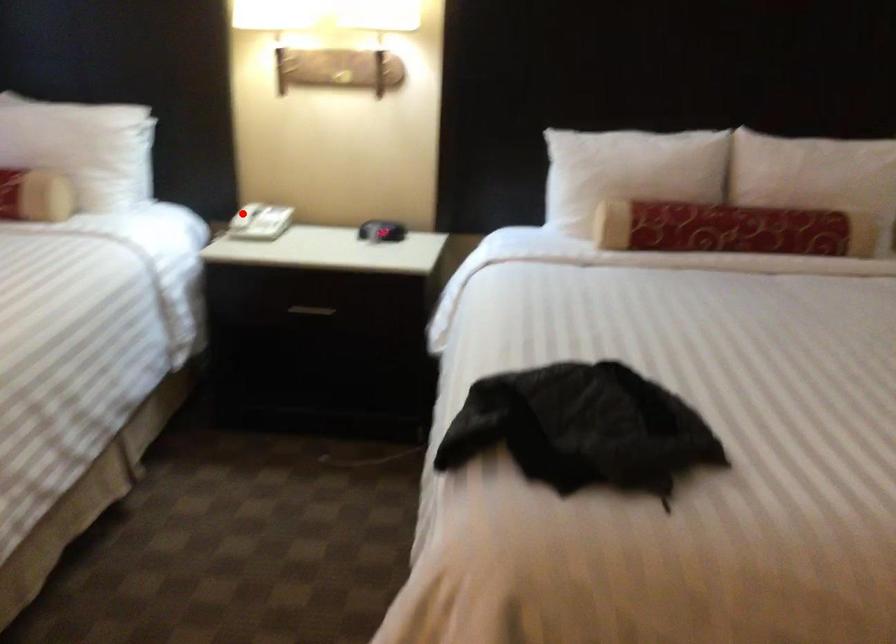
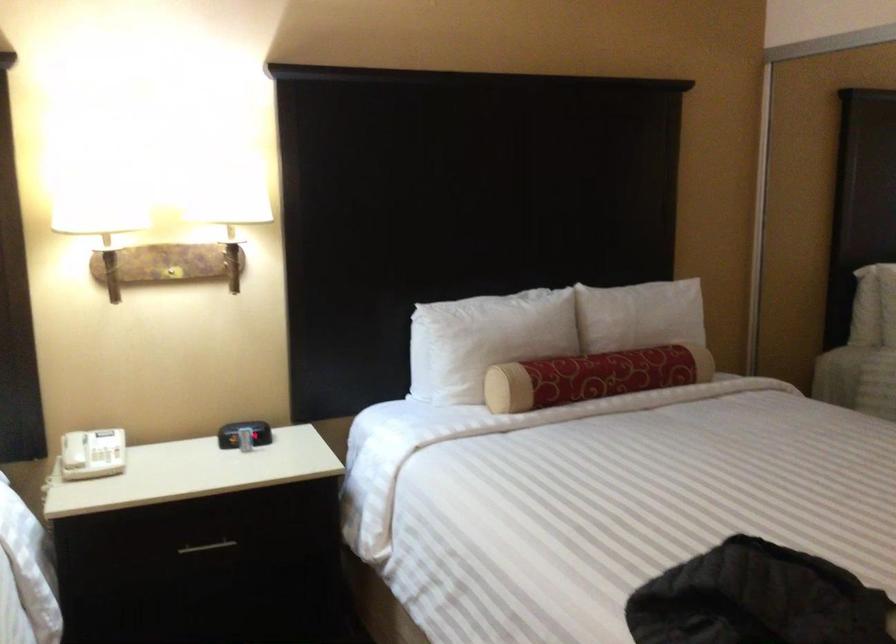
Question: I am providing you with two images of the same scene from different viewpoints. A red point is marked on the first image. At the location where the point appears in image 1, is it still visible in image 2?

Choices:
 (A) Yes
 (B) No

Answer: (A)